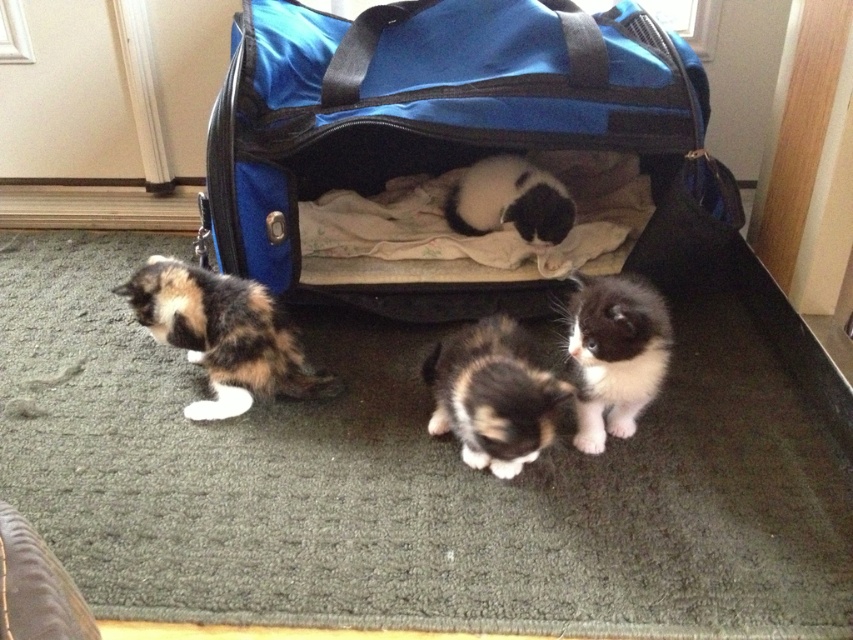
You are a pet owner who wants to place a 20 cm wide toy inside the blue fabric bag at center without disturbing the black and white fur cat at center. Is there enough space between them to fit the toy?

The blue fabric bag at center and black and white fur cat at center are 19.90 centimeters apart. Since the toy is 20 cm wide, it is slightly wider than the available space, so the toy cannot fit between them without moving the cat.

You are a photographer trying to capture a clear shot of both the blue fabric bag at center and the black and white fur cat at center. Since you want both subjects in focus, which one should you adjust your camera focus on first?

The blue fabric bag at center is closer to the viewer than the black and white fur cat at center, so you should focus on the blue fabric bag at center first to ensure both are in focus.